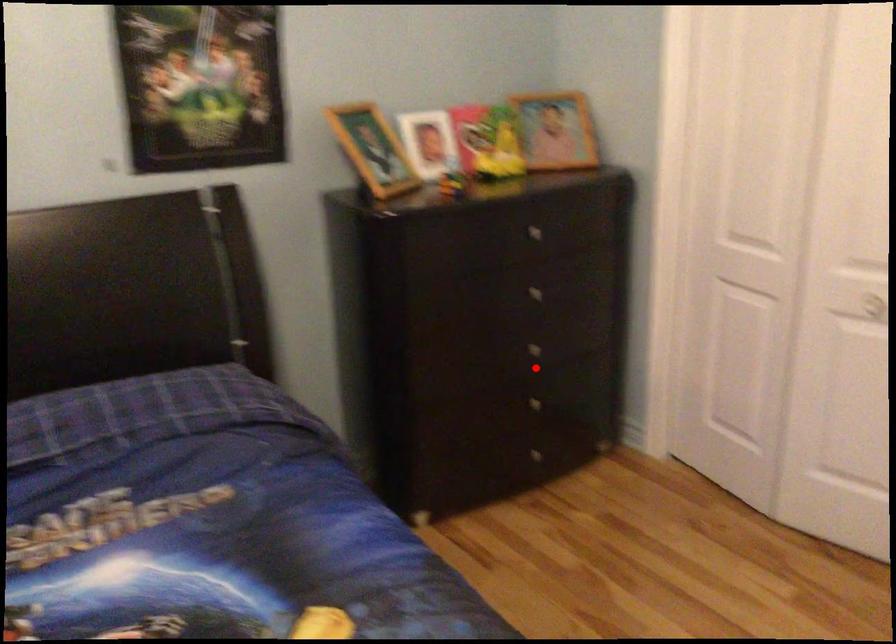
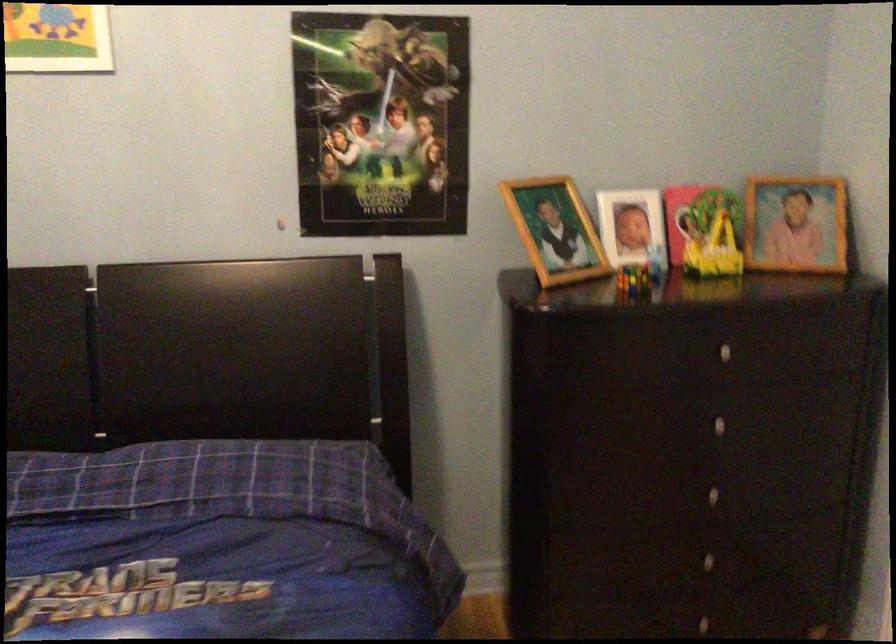
Question: I am providing you with two images of the same scene from different viewpoints. In image1, a red point is highlighted. Considering the same 3D point in image2, which of the following is correct?

Choices:
 (A) It is closer
 (B) It is farther

Answer: (A)